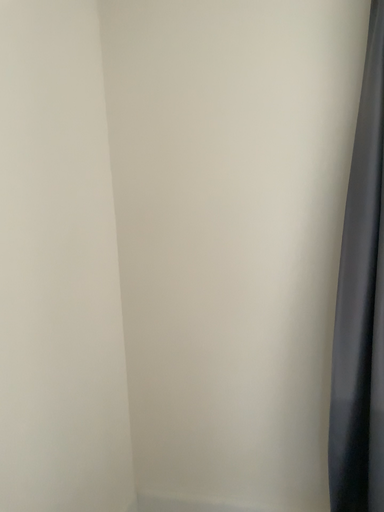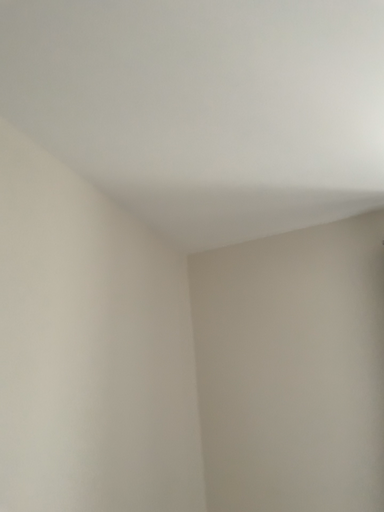
Question: Which way did the camera rotate in the video?

Choices:
 (A) rotated upward
 (B) rotated downward

Answer: (A)